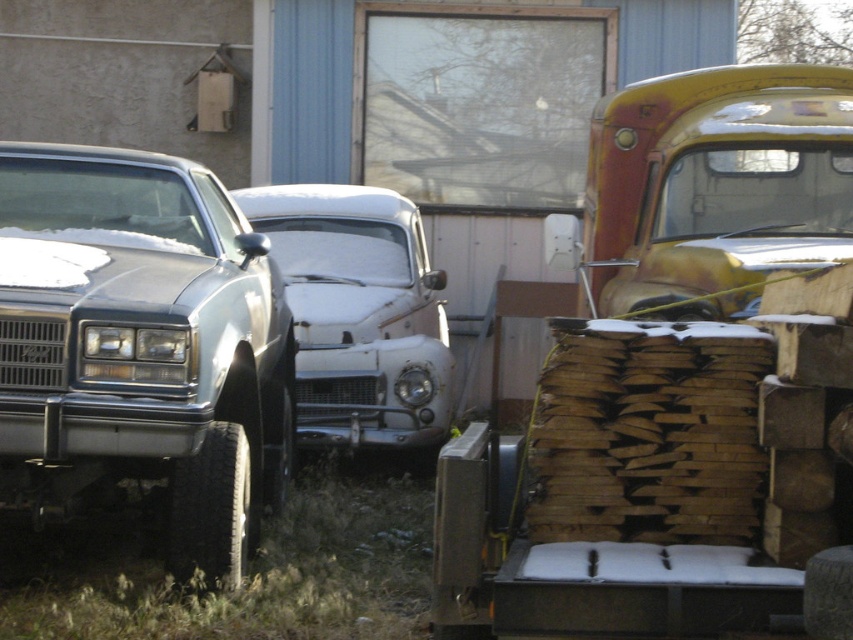
You are a delivery person trying to navigate through the area between the rusty metal truck at upper right and the rusty metallic car at center. Based on their positions, which direction should you move to pass between them?

The rusty metal truck at upper right is above the rusty metallic car at center, so you should move downward to pass between them.

You are standing at the center of the image. Which direction should you look to see the satin silver car at left?

The satin silver car at left is located at point (142,346), so you should look to the left to see it.

You are a delivery driver who needs to back up your truck from the parking lot. You see the satin silver car at left and the rusty metal truck at upper right. Which vehicle should you avoid hitting by checking your left side mirror?

You should avoid hitting the satin silver car at left by checking your left side mirror because it is positioned to the left of the rusty metal truck at upper right.